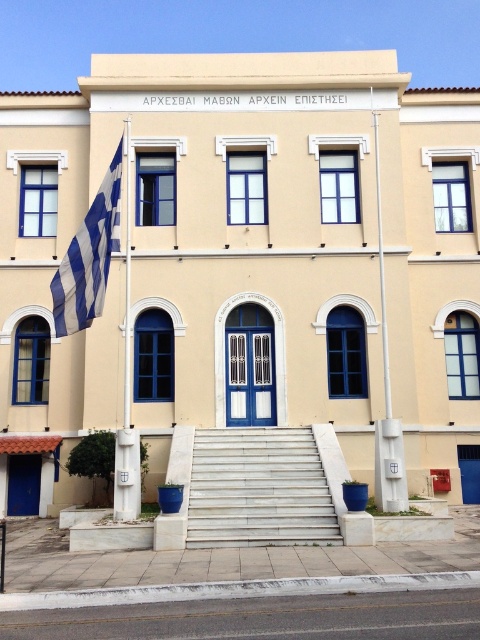
Question: Which point is farther from the camera taking this photo?

Choices:
 (A) pos(201,536)
 (B) pos(389,380)
 (C) pos(105,250)
 (D) pos(127,166)

Answer: (D)

Question: Does blue and white striped flag at left lie behind white painted metal flag pole at left?

Choices:
 (A) no
 (B) yes

Answer: (A)

Question: Is white concrete stairs at center bigger than white painted metal flag pole at left?

Choices:
 (A) yes
 (B) no

Answer: (B)

Question: Is beige stucco building at center wider than white concrete stairs at center?

Choices:
 (A) no
 (B) yes

Answer: (B)

Question: Which of the following is the closest to the observer?

Choices:
 (A) white plastic flag pole at upper center
 (B) white concrete stairs at center
 (C) blue and white striped flag at left

Answer: (B)

Question: Which point is closer to the camera?

Choices:
 (A) (257, 502)
 (B) (302, 196)
 (C) (50, 289)
 (D) (127, 225)

Answer: (A)